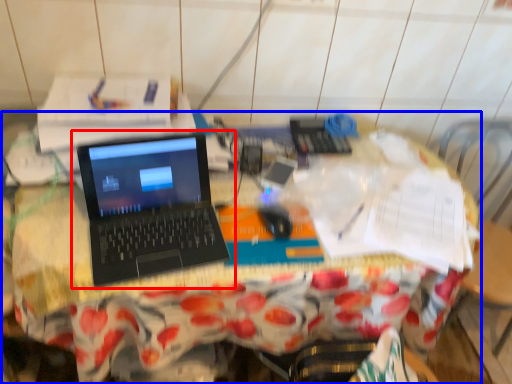
Question: Which point is closer to the camera, laptop (highlighted by a red box) or desk (highlighted by a blue box)?

Choices:
 (A) laptop
 (B) desk

Answer: (A)